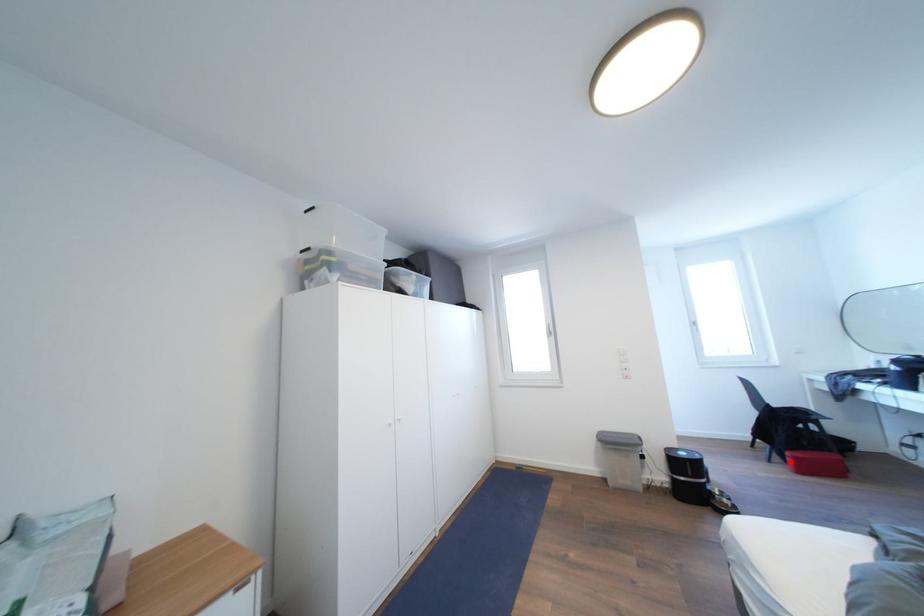
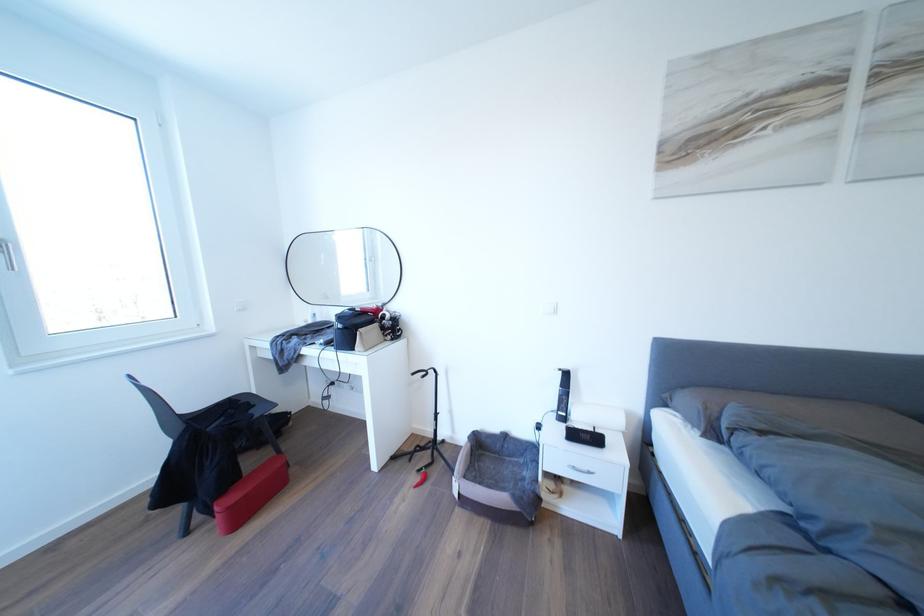
Where in the second image is the point corresponding to the highlighted location from the first image?

(217, 519)